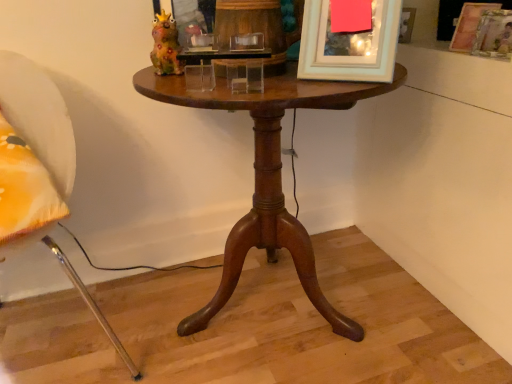
Question: From the image's perspective, is white matte picture frame at upper center, the first picture frame viewed from the left, under wooden picture frame at upper right, positioned as the 2th picture frame in front-to-back order?

Choices:
 (A) no
 (B) yes

Answer: (B)

Question: Can you confirm if white matte picture frame at upper center, acting as the 3th picture frame starting from the right, is positioned to the left of wooden picture frame at upper right, which is counted as the first picture frame, starting from the right?

Choices:
 (A) yes
 (B) no

Answer: (A)

Question: From the image's perspective, is white matte picture frame at upper center, positioned as the 3th picture frame in back-to-front order, on top of wooden picture frame at upper right, which is counted as the first picture frame, starting from the right?

Choices:
 (A) no
 (B) yes

Answer: (A)

Question: Is white matte picture frame at upper center, positioned as the 3th picture frame in back-to-front order, positioned beyond the bounds of wooden picture frame at upper right, which is counted as the first picture frame, starting from the right?

Choices:
 (A) no
 (B) yes

Answer: (B)

Question: Does white matte picture frame at upper center, the first picture frame viewed from the left, have a smaller size compared to wooden picture frame at upper right, the 2th picture frame from the back?

Choices:
 (A) yes
 (B) no

Answer: (B)

Question: From the image's perspective, is wooden picture frame at upper right, positioned as the 2th picture frame in front-to-back order, positioned above or below mahogany wood table at center?

Choices:
 (A) below
 (B) above

Answer: (B)

Question: Considering their positions, is wooden picture frame at upper right, arranged as the 3th picture frame when viewed from the left, located in front of or behind mahogany wood table at center?

Choices:
 (A) front
 (B) behind

Answer: (B)

Question: Considering the positions of point (492, 31) and point (312, 102), is point (492, 31) closer or farther from the camera than point (312, 102)?

Choices:
 (A) farther
 (B) closer

Answer: (A)

Question: From a real-world perspective, relative to mahogany wood table at center, is wooden picture frame at upper right, which is counted as the first picture frame, starting from the right, vertically above or below?

Choices:
 (A) above
 (B) below

Answer: (A)

Question: Considering their positions, is mahogany wood table at center located in front of or behind white fabric chair at left?

Choices:
 (A) front
 (B) behind

Answer: (B)

Question: Is point (272, 185) positioned closer to the camera than point (62, 253)?

Choices:
 (A) farther
 (B) closer

Answer: (B)

Question: Would you say mahogany wood table at center is inside or outside white fabric chair at left?

Choices:
 (A) outside
 (B) inside

Answer: (A)

Question: Considering the positions of mahogany wood table at center and white fabric chair at left in the image, is mahogany wood table at center bigger or smaller than white fabric chair at left?

Choices:
 (A) big
 (B) small

Answer: (A)

Question: Considering the positions of point (455, 33) and point (46, 97), is point (455, 33) closer or farther from the camera than point (46, 97)?

Choices:
 (A) farther
 (B) closer

Answer: (A)

Question: Relative to white fabric chair at left, is wooden picture frame at upper right, the 3th picture frame in the front-to-back sequence, in front or behind?

Choices:
 (A) front
 (B) behind

Answer: (B)